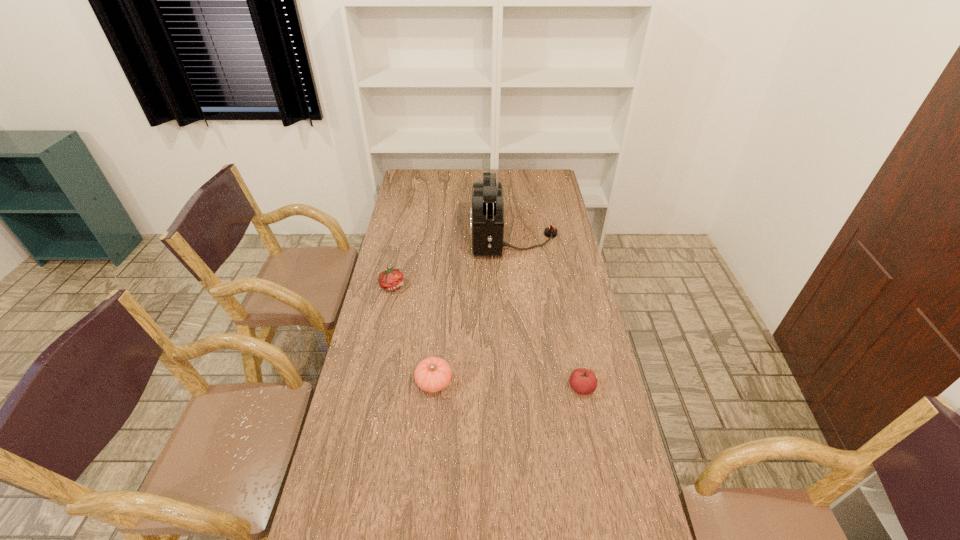
Find the location of a particular element. The height and width of the screenshot is (540, 960). object that stands as the second closest to the tallest object is located at coordinates (433, 374).

Identify which tomato is the closest to the third nearest object. Please provide its 2D coordinates. Your answer should be formatted as a tuple, i.e. [(x, y)], where the tuple contains the x and y coordinates of a point satisfying the conditions above.

[(433, 374)]

Where is `tomato that can be found as the second closest to the second farthest object`? This screenshot has width=960, height=540. tomato that can be found as the second closest to the second farthest object is located at coordinates (583, 381).

This screenshot has width=960, height=540. In order to click on free spot that satisfies the following two spatial constraints: 1. on the front side of the third nearest object; 2. on the left side of the rightmost tomato in this screenshot , I will do `click(371, 388)`.

Where is `free space that satisfies the following two spatial constraints: 1. on the front-facing side of the farthest object; 2. on the left side of the rightmost tomato`? free space that satisfies the following two spatial constraints: 1. on the front-facing side of the farthest object; 2. on the left side of the rightmost tomato is located at coordinates (528, 388).

You are a GUI agent. You are given a task and a screenshot of the screen. Output one action in this format:
    pyautogui.click(x=<x>, y=<y>)
    Task: Click on the free space that satisfies the following two spatial constraints: 1. on the front-facing side of the rightmost tomato; 2. on the left side of the farthest object
    The height and width of the screenshot is (540, 960).
    Given the screenshot: What is the action you would take?
    pyautogui.click(x=528, y=388)

You are a GUI agent. You are given a task and a screenshot of the screen. Output one action in this format:
    pyautogui.click(x=<x>, y=<y>)
    Task: Click on the vacant space that satisfies the following two spatial constraints: 1. on the front-facing side of the rightmost tomato; 2. on the right side of the radio receiver
    
    Given the screenshot: What is the action you would take?
    pyautogui.click(x=528, y=388)

Where is `free location that satisfies the following two spatial constraints: 1. on the front side of the second tomato from left to right; 2. on the right side of the second farthest object`? free location that satisfies the following two spatial constraints: 1. on the front side of the second tomato from left to right; 2. on the right side of the second farthest object is located at coordinates (372, 382).